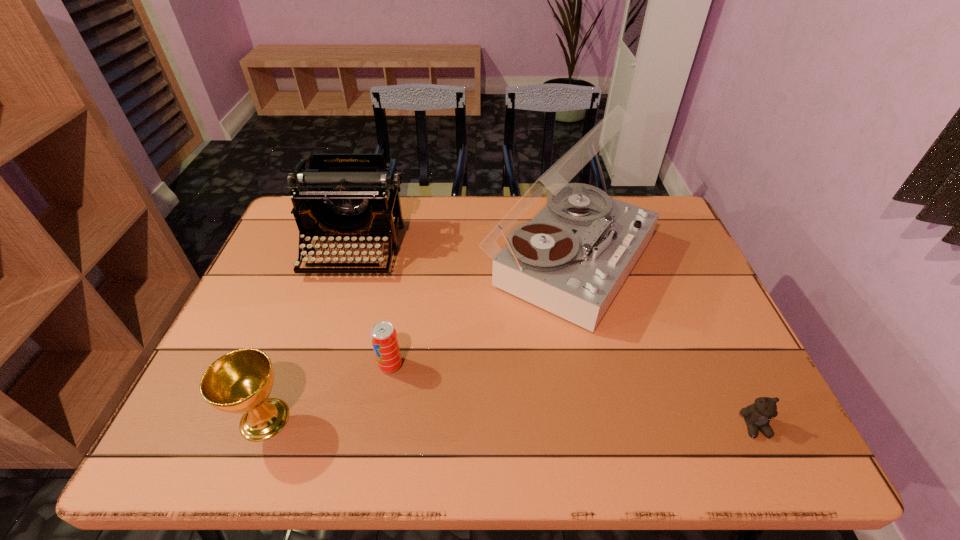
The width and height of the screenshot is (960, 540). Identify the location of the closest object to the record player. (384, 339).

This screenshot has width=960, height=540. Identify the location of vacant region that satisfies the following two spatial constraints: 1. on the typing side of the second tallest object; 2. on the left side of the soda can. (318, 364).

Find the location of a particular element. The height and width of the screenshot is (540, 960). vacant space that satisfies the following two spatial constraints: 1. on the typing side of the fourth shortest object; 2. on the left side of the record player is located at coordinates (350, 260).

Locate an element on the screen. The width and height of the screenshot is (960, 540). free space that satisfies the following two spatial constraints: 1. on the typing side of the fourth tallest object; 2. on the right side of the second tallest object is located at coordinates pyautogui.click(x=318, y=364).

You are a GUI agent. You are given a task and a screenshot of the screen. Output one action in this format:
    pyautogui.click(x=<x>, y=<y>)
    Task: Click on the vacant space that satisfies the following two spatial constraints: 1. on the typing side of the second tallest object; 2. on the right side of the second object from right to left
    The image size is (960, 540).
    Given the screenshot: What is the action you would take?
    pyautogui.click(x=350, y=260)